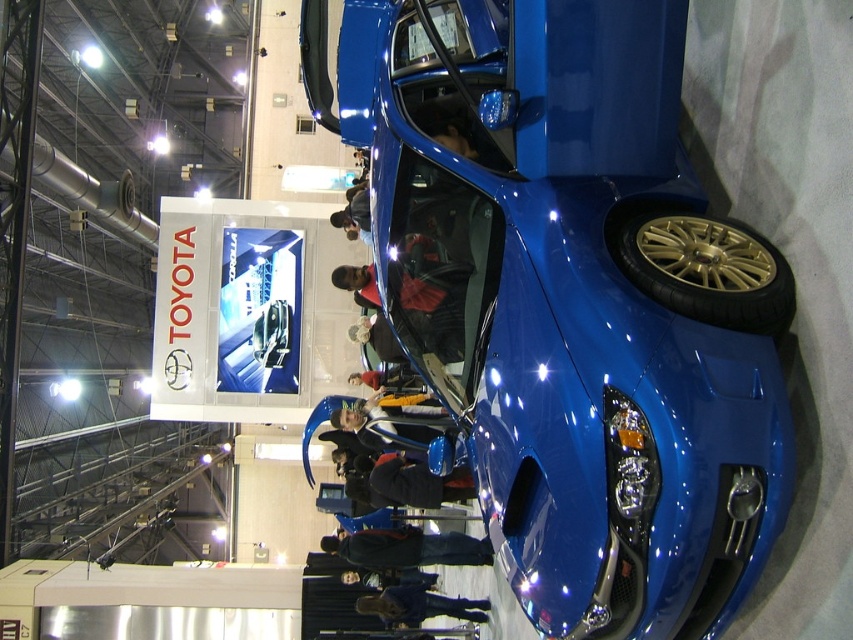
You are a photographer setting up for a car advertisement shoot. You have to position a spotlight so it illuminates both the shiny blue car at center and the gold metallic tire at lower right. Given their sizes, which object requires a larger spotlight to cover its entire surface?

The shiny blue car at center requires a larger spotlight because it is bigger than the gold metallic tire at lower right.

You are standing at the entrance of the auto show and want to take a photo of the shiny blue car at center. If you are facing the car, which direction should you move to get closer to it?

Since the shiny blue car at center is located at point 0.466 on the x axis and 0.672 on the y axis, you should move forward to get closer to it as you are facing the car.

You are a photographer at the auto show and want to capture a photo that includes both the shiny blue car at center and the gold metallic tire at lower right. Based on their positions, which object should you focus on first to ensure both are in frame?

The shiny blue car at center is above the gold metallic tire at lower right, so you should focus on the gold metallic tire at lower right first to ensure both are in frame.